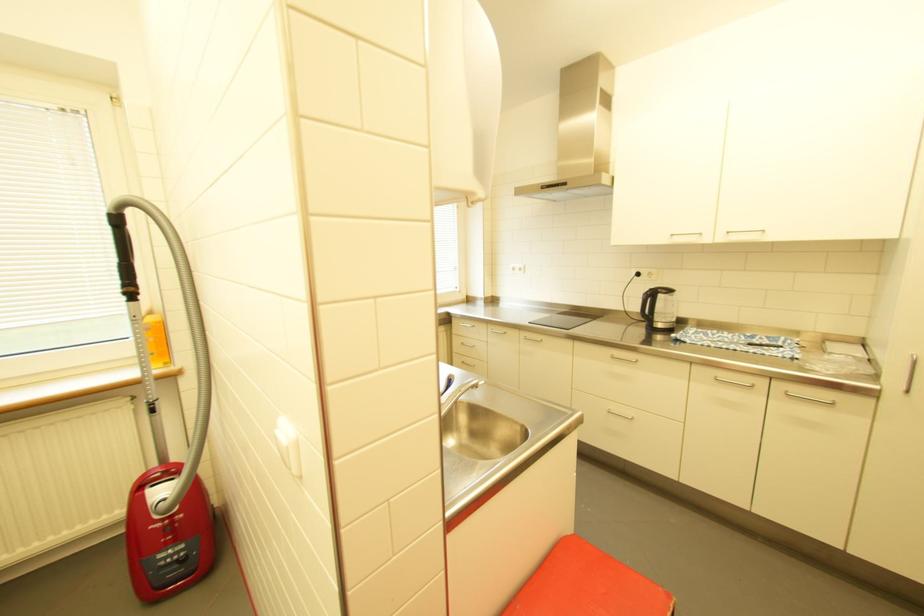
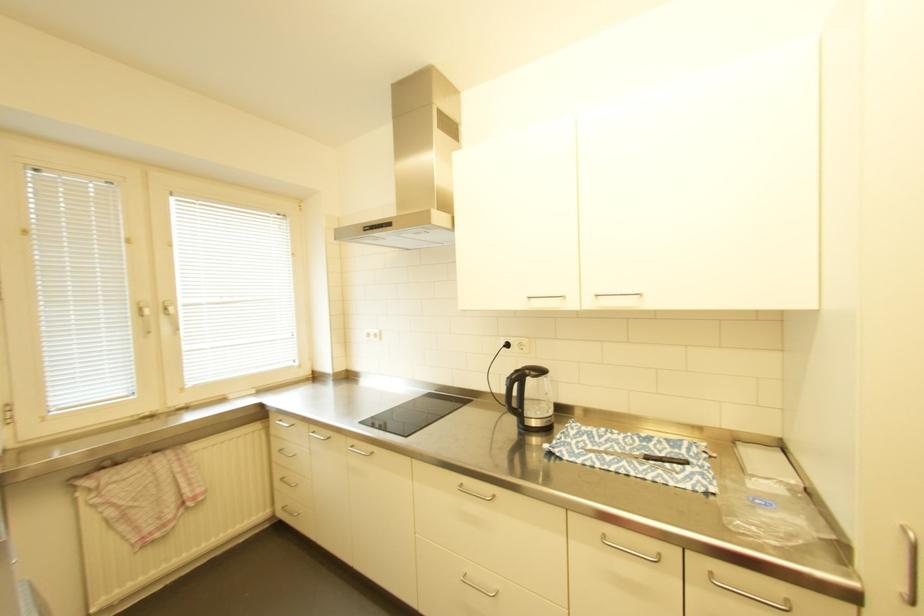
Where in the second image is the point corresponding to [470,323] from the first image?

(287, 421)